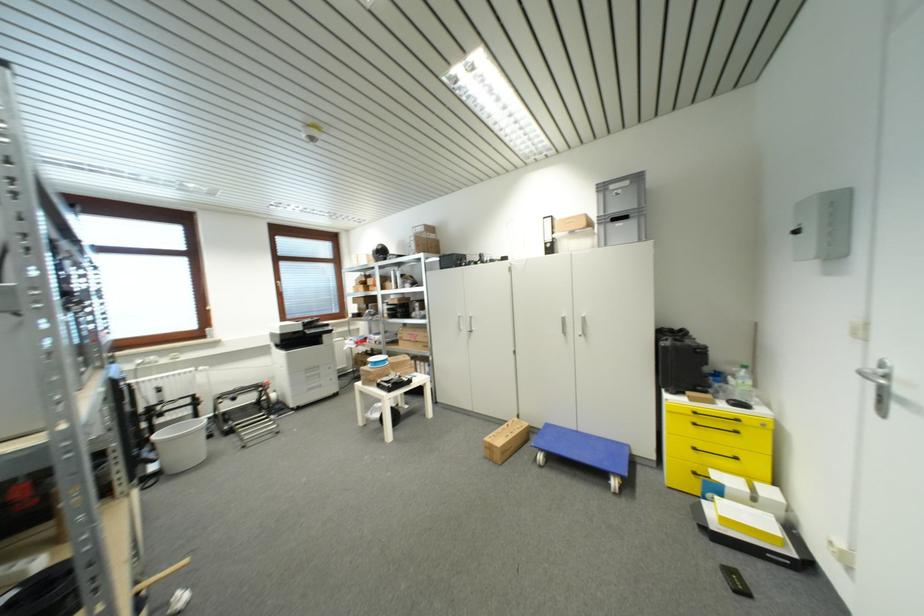
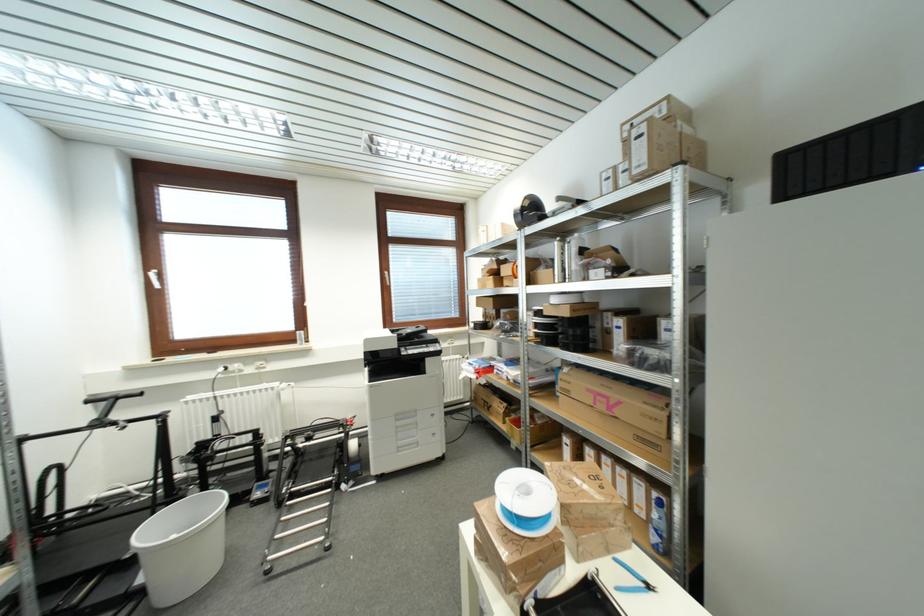
Find the pixel in the second image that matches the point at 379,249 in the first image.

(523, 207)